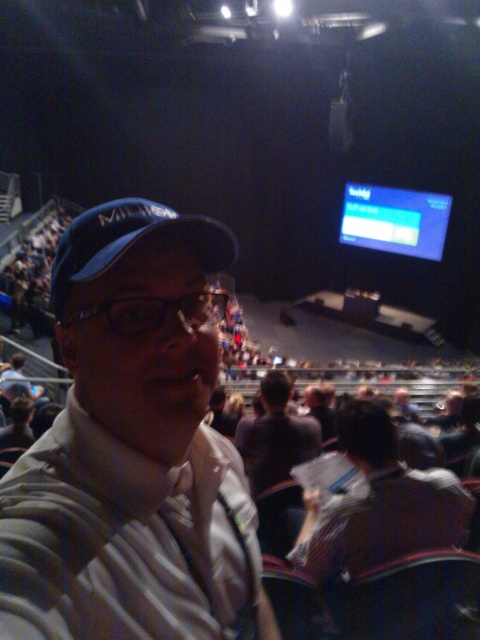
Question: Can you confirm if striped fabric shirt at center is positioned below matte blue screen at upper right?

Choices:
 (A) no
 (B) yes

Answer: (B)

Question: Is striped fabric shirt at center smaller than dark brown shirt at center?

Choices:
 (A) yes
 (B) no

Answer: (B)

Question: Can you confirm if striped cotton shirt at center is positioned to the right of dark brown shirt at center?

Choices:
 (A) yes
 (B) no

Answer: (B)

Question: Which of the following is the farthest from the observer?

Choices:
 (A) blue fabric cap at center
 (B) matte blue screen at upper right
 (C) dark brown shirt at center
 (D) striped cotton shirt at center

Answer: (B)

Question: Which object is closer to the camera taking this photo?

Choices:
 (A) dark brown shirt at center
 (B) matte blue screen at upper right
 (C) striped cotton shirt at center

Answer: (C)

Question: Which of the following is the closest to the observer?

Choices:
 (A) dark brown shirt at center
 (B) striped cotton shirt at center
 (C) striped fabric shirt at center

Answer: (B)